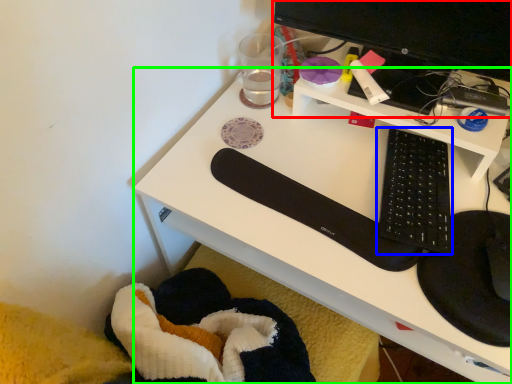
Question: Which object is positioned farthest from desktop computer (highlighted by a red box)? Select from computer keyboard (highlighted by a blue box) and desk (highlighted by a green box).

Choices:
 (A) computer keyboard
 (B) desk

Answer: (B)